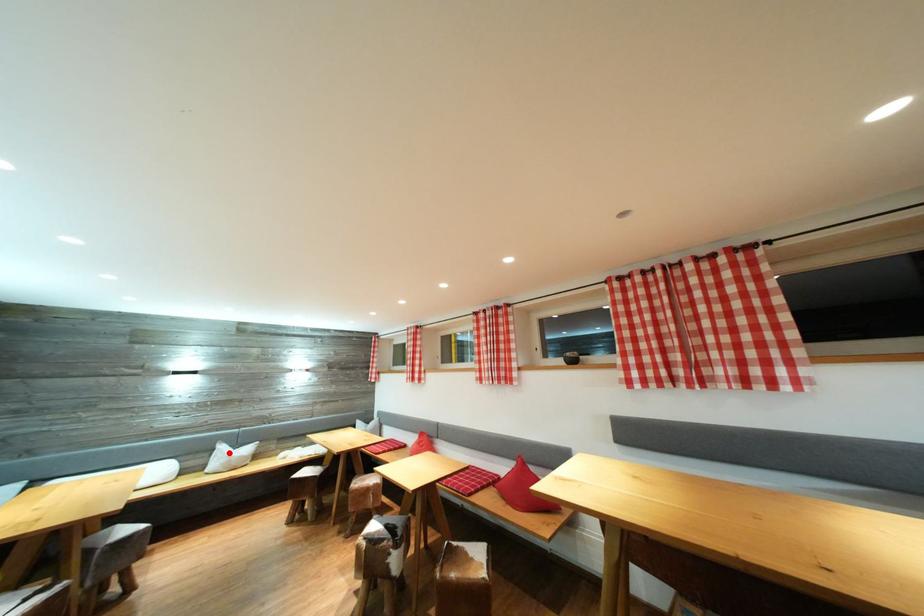
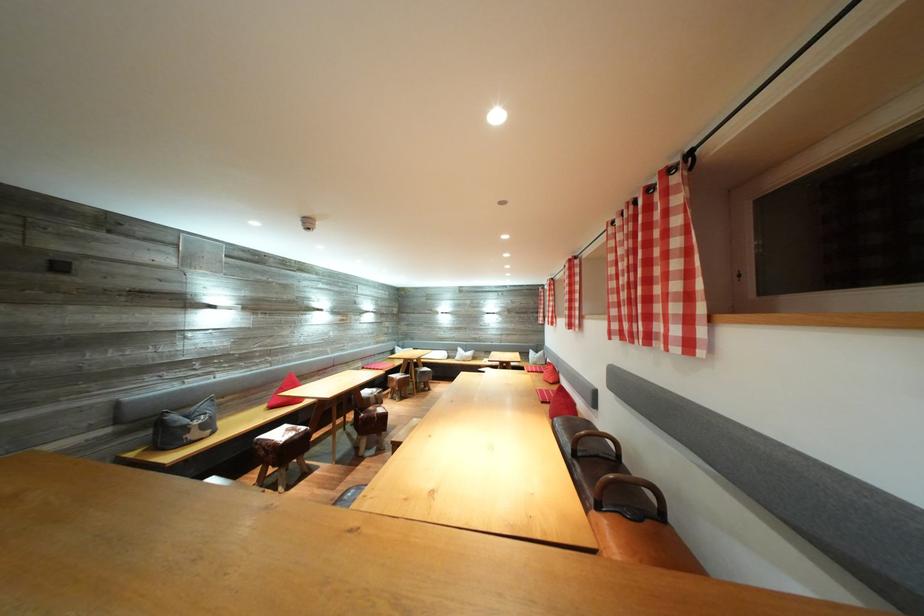
Question: I am providing you with two images of the same scene from different viewpoints. A red point is marked on the first image. Is the red point's position out of view in image 2?

Choices:
 (A) Yes
 (B) No

Answer: (B)